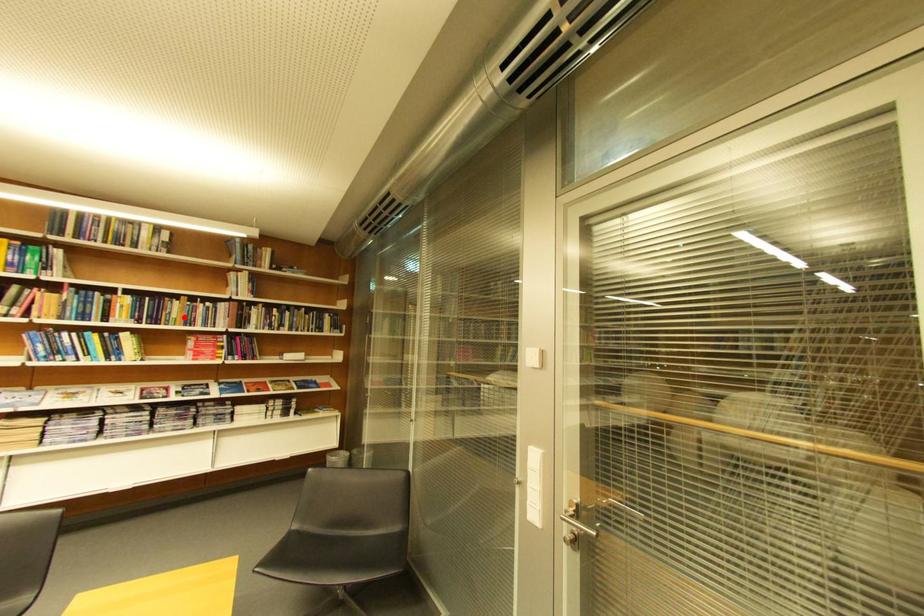
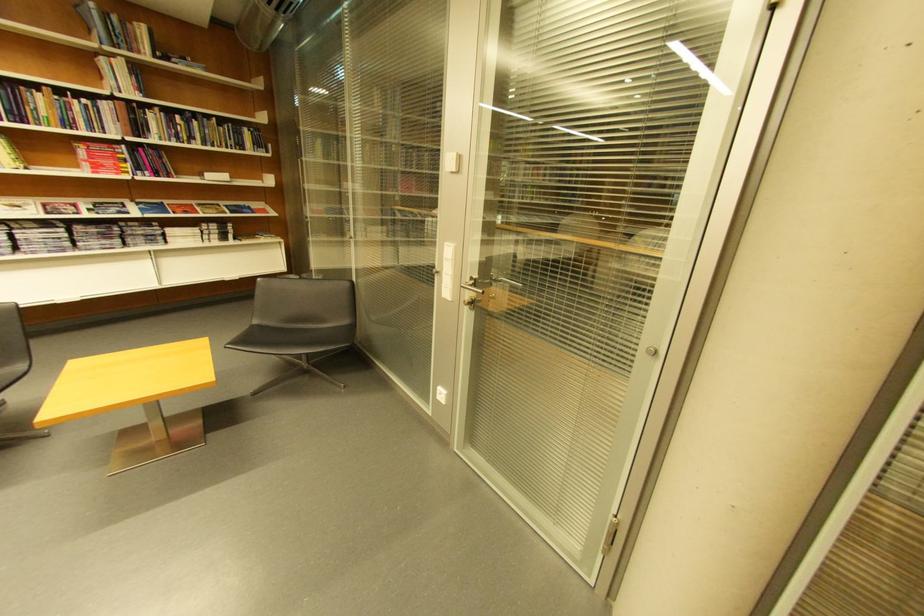
Locate, in the second image, the point that corresponds to the highlighted location in the first image.

(54, 116)